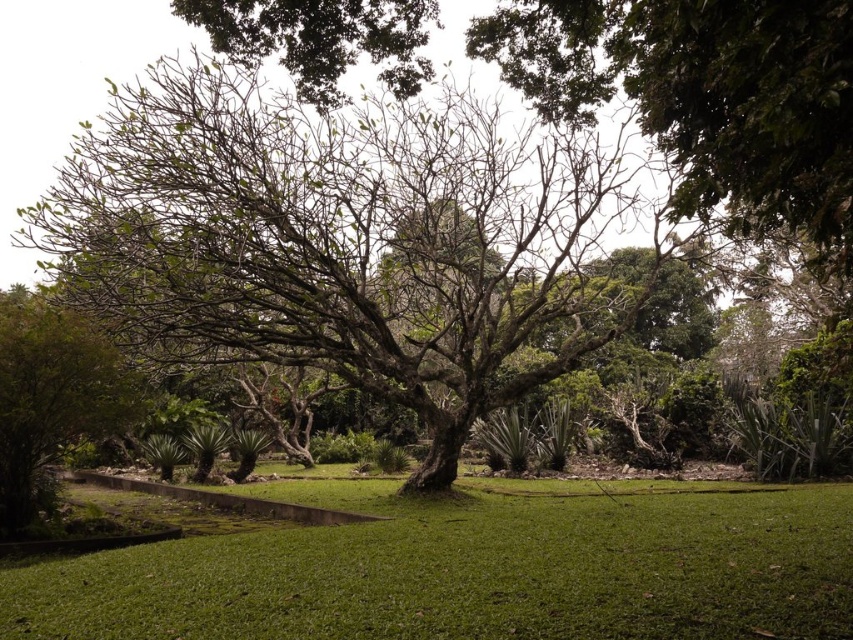
Is green leafy tree at center below green grass at center?

No.

Who is more distant from viewer, (451,284) or (805,596)?

Positioned behind is point (451,284).

Locate an element on the screen. Image resolution: width=853 pixels, height=640 pixels. green leafy tree at center is located at coordinates (350, 237).